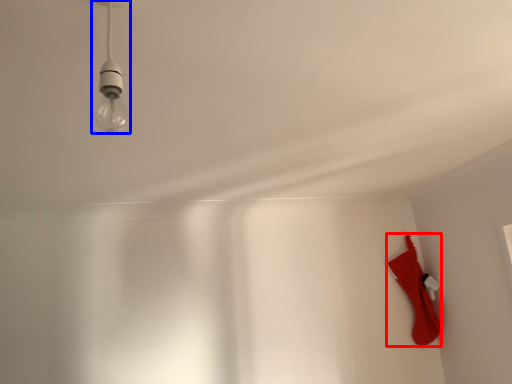
Question: Which point is further to the camera, sock (highlighted by a red box) or lamp (highlighted by a blue box)?

Choices:
 (A) sock
 (B) lamp

Answer: (A)